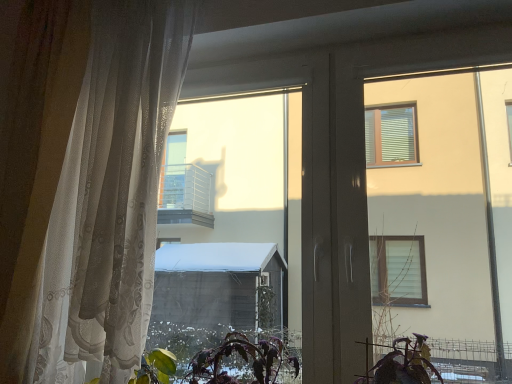
At what (x,y) coordinates should I click in order to perform the action: click on purple matte plant at lower center. Please return your answer as a coordinate pair (x, y). Looking at the image, I should click on (221, 359).

Describe the element at coordinates (221, 359) in the screenshot. I see `purple matte plant at lower center` at that location.

The image size is (512, 384). What do you see at coordinates (86, 183) in the screenshot? I see `sheer white curtain at left` at bounding box center [86, 183].

Locate an element on the screen. This screenshot has width=512, height=384. sheer white curtain at left is located at coordinates (86, 183).

Image resolution: width=512 pixels, height=384 pixels. Identify the location of purple matte plant at lower center. (221, 359).

Based on their positions, is sheer white curtain at left located to the left or right of purple matte plant at lower center?

From the image, it's evident that sheer white curtain at left is to the left of purple matte plant at lower center.

Considering the relative positions of sheer white curtain at left and purple matte plant at lower center in the image provided, is sheer white curtain at left behind purple matte plant at lower center?

No, the depth of sheer white curtain at left is less than that of purple matte plant at lower center.

Which point is more forward, (x=122, y=281) or (x=173, y=364)?

The point (x=122, y=281) is in front.

From the image's perspective, relative to purple matte plant at lower center, is sheer white curtain at left above or below?

sheer white curtain at left is situated higher than purple matte plant at lower center in the image.

From a real-world perspective, does sheer white curtain at left stand above purple matte plant at lower center?

Indeed, from a real-world perspective, sheer white curtain at left stands above purple matte plant at lower center.

Does sheer white curtain at left have a lesser width compared to purple matte plant at lower center?

In fact, sheer white curtain at left might be wider than purple matte plant at lower center.

In the scene shown: Does sheer white curtain at left have a greater height compared to purple matte plant at lower center?

Yes.

Who is smaller, sheer white curtain at left or purple matte plant at lower center?

purple matte plant at lower center is smaller.

Can we say sheer white curtain at left lies outside purple matte plant at lower center?

Yes, sheer white curtain at left is outside of purple matte plant at lower center.

Would you say sheer white curtain at left is a long distance from purple matte plant at lower center?

sheer white curtain at left is near purple matte plant at lower center, not far away.

Is sheer white curtain at left positioned with its back to purple matte plant at lower center?

No, sheer white curtain at left is not facing away from purple matte plant at lower center.

How different are the orientations of sheer white curtain at left and purple matte plant at lower center in degrees?

They differ by 5.99 degrees in their facing directions.

You are a GUI agent. You are given a task and a screenshot of the screen. Output one action in this format:
    pyautogui.click(x=<x>, y=<y>)
    Task: Click on the curtain lying above the purple matte plant at lower center (from the image's perspective)
    The width and height of the screenshot is (512, 384).
    Given the screenshot: What is the action you would take?
    pyautogui.click(x=86, y=183)

Can you confirm if purple matte plant at lower center is positioned to the right of sheer white curtain at left?

Yes.

Is the position of purple matte plant at lower center more distant than that of sheer white curtain at left?

Yes, it is.

Which is further, (152,356) or (70,43)?

The point (70,43) is behind.

From the image's perspective, is purple matte plant at lower center positioned above or below sheer white curtain at left?

Clearly, from the image's perspective, purple matte plant at lower center is below sheer white curtain at left.

From a real-world perspective, is purple matte plant at lower center beneath sheer white curtain at left?

Correct, in the physical world, purple matte plant at lower center is lower than sheer white curtain at left.

Considering the sizes of objects purple matte plant at lower center and sheer white curtain at left in the image provided, who is wider, purple matte plant at lower center or sheer white curtain at left?

sheer white curtain at left is wider.

Between purple matte plant at lower center and sheer white curtain at left, which one has more height?

sheer white curtain at left.

Between purple matte plant at lower center and sheer white curtain at left, which one has larger size?

sheer white curtain at left.

Can we say purple matte plant at lower center lies outside sheer white curtain at left?

Yes, purple matte plant at lower center is outside of sheer white curtain at left.

Is purple matte plant at lower center placed right next to sheer white curtain at left?

They are not placed beside each other.

Is purple matte plant at lower center aimed at sheer white curtain at left?

No, purple matte plant at lower center is not turned towards sheer white curtain at left.

How distant is purple matte plant at lower center from sheer white curtain at left?

A distance of 22.54 inches exists between purple matte plant at lower center and sheer white curtain at left.

This screenshot has width=512, height=384. I want to click on vegetation that is below the sheer white curtain at left (from the image's perspective), so click(221, 359).

Locate an element on the screen. This screenshot has height=384, width=512. vegetation behind the sheer white curtain at left is located at coordinates (221, 359).

Find the location of a particular element. vegetation on the right of sheer white curtain at left is located at coordinates (221, 359).